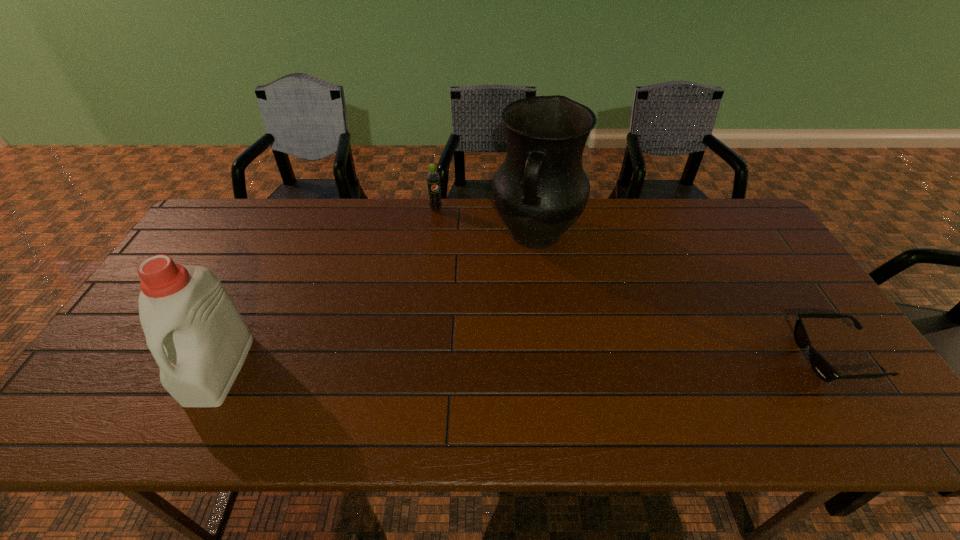
Identify the location of vacant space located 0.310m on the front-facing side of the sunglasses. This screenshot has height=540, width=960. (673, 357).

This screenshot has width=960, height=540. In order to click on vacant area situated on the handle side of the tallest object in this screenshot , I will do `click(516, 288)`.

Where is `free location located 0.220m on the handle side of the tallest object`? free location located 0.220m on the handle side of the tallest object is located at coordinates (504, 320).

Where is `vacant space located on the handle side of the tallest object`? This screenshot has height=540, width=960. vacant space located on the handle side of the tallest object is located at coordinates (516, 286).

Locate an element on the screen. The width and height of the screenshot is (960, 540). vacant region located on the front label of the third object from right to left is located at coordinates (448, 240).

I want to click on free space located 0.120m on the front label of the third object from right to left, so click(x=446, y=234).

The width and height of the screenshot is (960, 540). Identify the location of free spot located 0.140m on the front label of the third object from right to left. (447, 238).

Image resolution: width=960 pixels, height=540 pixels. Identify the location of pitcher that is at the far edge. (540, 190).

What are the coordinates of `soda that is at the far edge` in the screenshot? It's located at 433,178.

Where is `detergent present at the near edge`? The width and height of the screenshot is (960, 540). detergent present at the near edge is located at coordinates (198, 338).